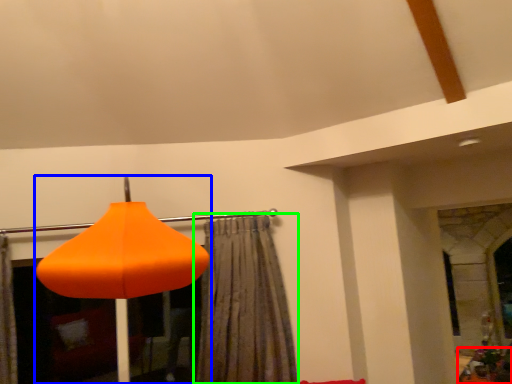
Question: Considering the real-world distances, which object is closest to furniture (highlighted by a red box)? lamp (highlighted by a blue box) or curtain (highlighted by a green box).

Choices:
 (A) lamp
 (B) curtain

Answer: (B)